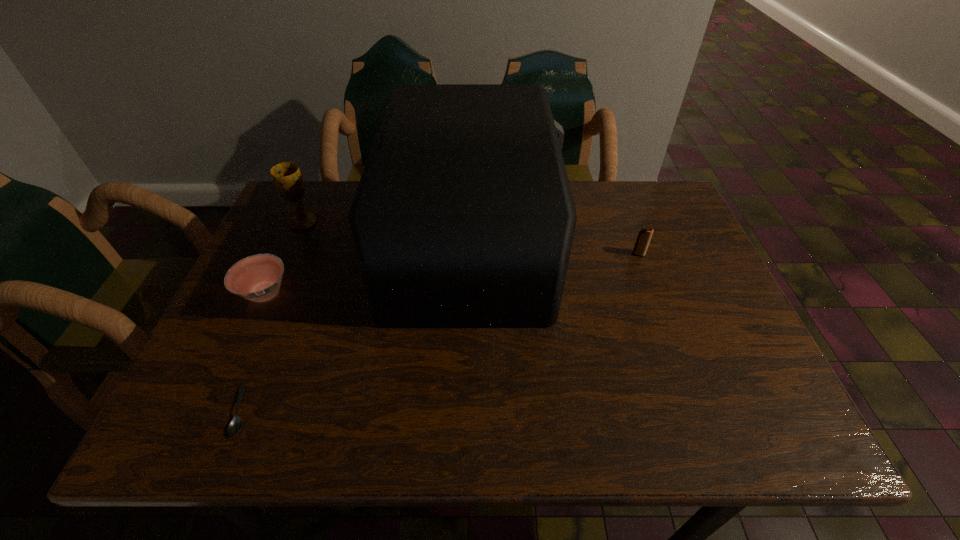
You are a GUI agent. You are given a task and a screenshot of the screen. Output one action in this format:
    pyautogui.click(x=<x>, y=<y>)
    Task: Click on the tallest object
    This screenshot has width=960, height=540.
    Given the screenshot: What is the action you would take?
    point(463,217)

This screenshot has height=540, width=960. Find the location of `microwave oven`. microwave oven is located at coordinates (463, 217).

Where is `the fourth shortest object`? Image resolution: width=960 pixels, height=540 pixels. the fourth shortest object is located at coordinates (287, 178).

Locate an element on the screen. The image size is (960, 540). igniter is located at coordinates (644, 236).

Identify the location of the rightmost object. (644, 236).

This screenshot has width=960, height=540. In order to click on bowl in this screenshot , I will do `click(258, 277)`.

Identify the location of the shortest object. (235, 425).

The image size is (960, 540). Identify the location of soupspoon. (235, 425).

Identify the location of vacant space located on the front-facing side of the tallest object. (581, 246).

Locate an element on the screen. The height and width of the screenshot is (540, 960). free space located 0.060m on the right of the second tallest object is located at coordinates [339, 222].